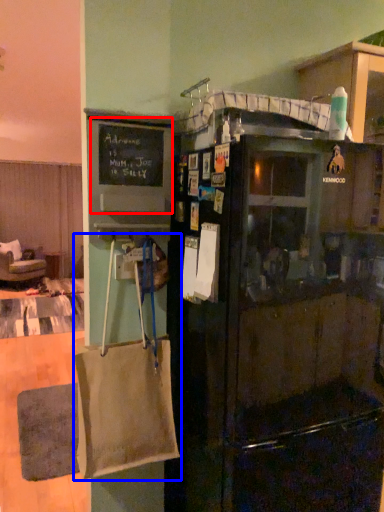
Question: Which point is closer to the camera, bulletin board (highlighted by a red box) or grocery bag (highlighted by a blue box)?

Choices:
 (A) bulletin board
 (B) grocery bag

Answer: (B)